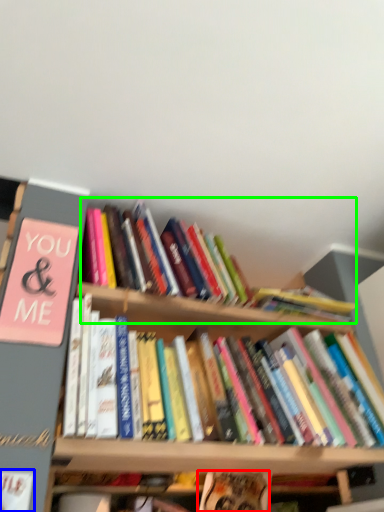
Question: Estimate the real-world distances between objects in this image. Which object is farther from book (highlighted by a red box), book (highlighted by a blue box) or book (highlighted by a green box)?

Choices:
 (A) book
 (B) book

Answer: (A)